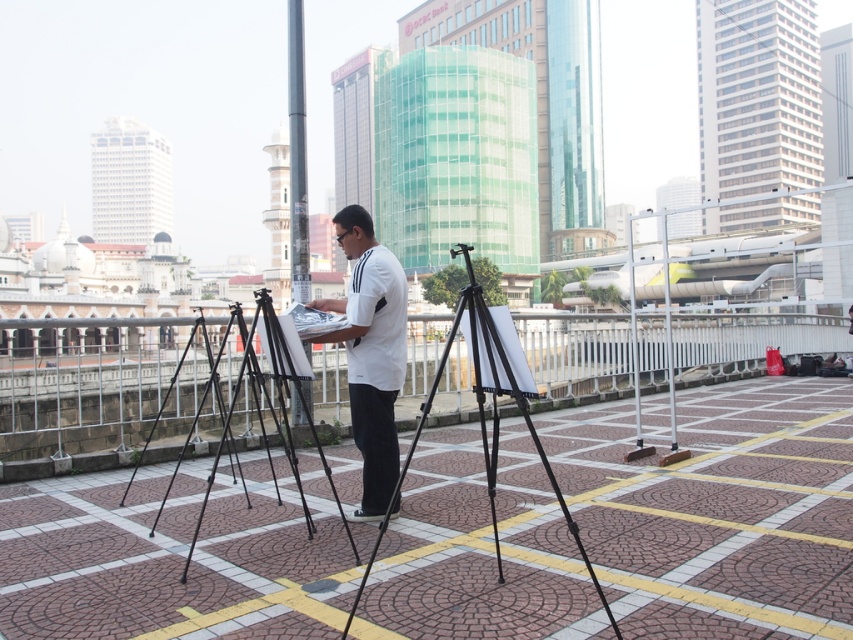
You are a photographer setting up a tripod in the urban scene. You notice the white matte shirt at center and the black matte tripod at center. Which object is positioned higher relative to the other?

The white matte shirt at center is above the black matte tripod at center.

You are a city planner reviewing this area. The black metal tripod at center and black metal pole at center are part of a new public art installation. Which object is placed underneath the other?

The black metal tripod at center is positioned under the black metal pole at center.

You are a photographer trying to capture the artist and their equipment. Based on the scene, which object is taller between the white matte shirt at center and the black matte tripod at center?

The white matte shirt at center is taller than the black matte tripod at center.